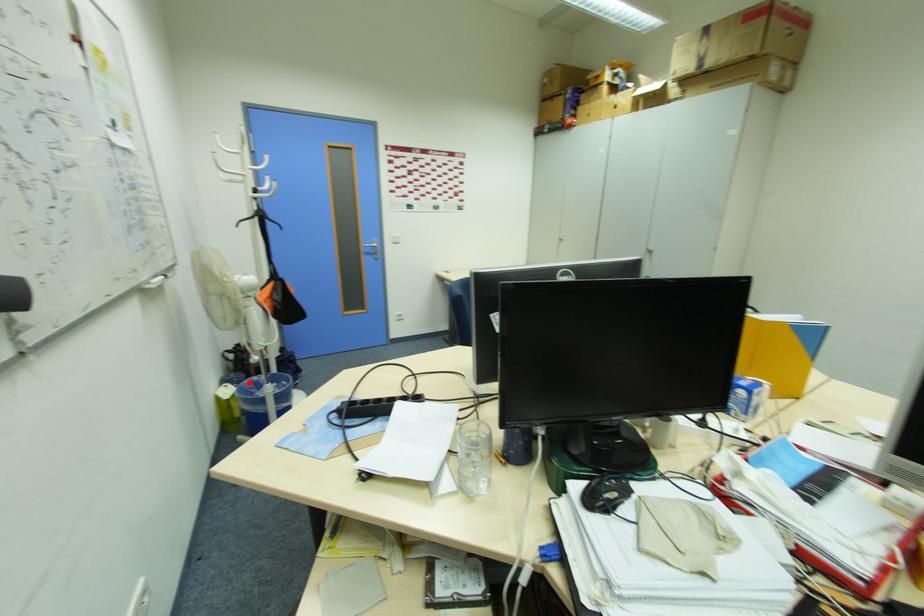
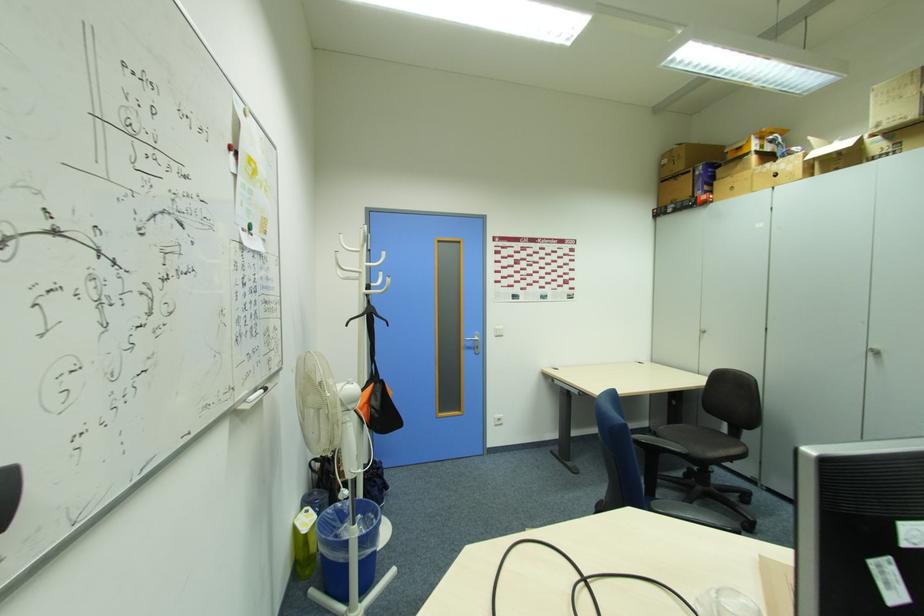
The point at the highlighted location is marked in the first image. Where is the corresponding point in the second image?

(334, 512)